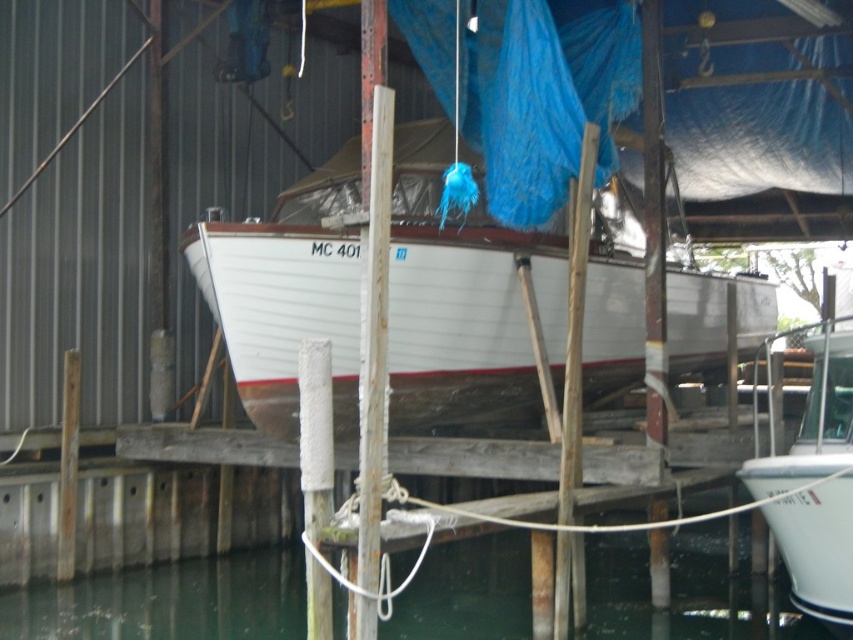
You are standing on the dock and notice the greenish water at lower center and the rusty metal pole at center. Which object is positioned to the left when facing the scene?

The greenish water at lower center is to the left of the rusty metal pole at center, so the greenish water at lower center is positioned to the left when facing the scene.

You are standing on the dock and want to locate the white wood boat at center. According to the coordinates provided, in which direction should you look relative to your position?

The white wood boat at center is located at coordinates point (463, 300), so you should look towards the center of the dock where the boat is positioned.